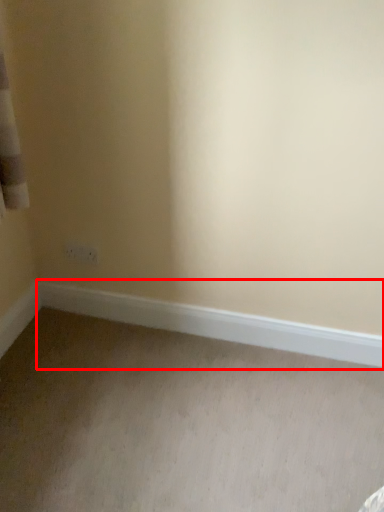
Question: Where is window sill (annotated by the red box) located in relation to plain in the image?

Choices:
 (A) right
 (B) left

Answer: (A)